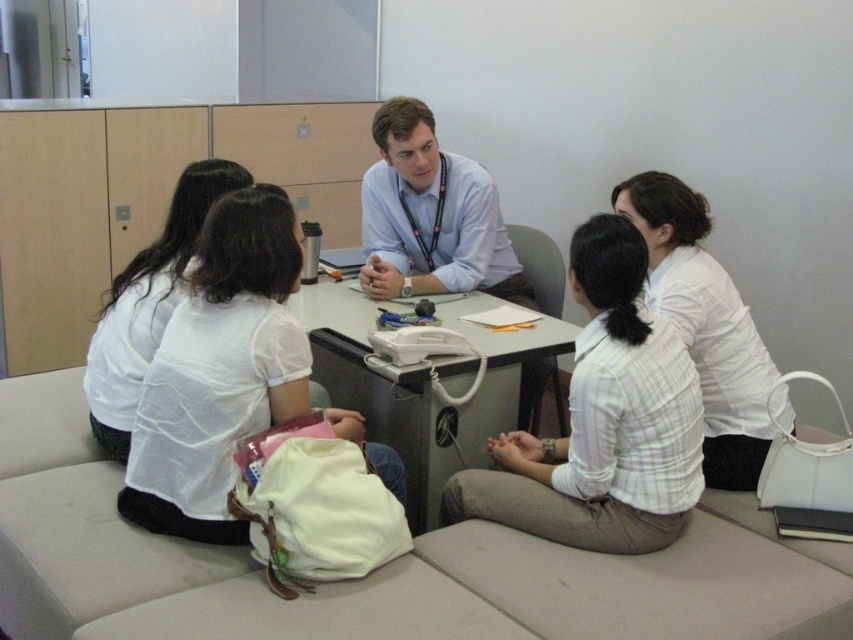
Does white matte backpack at lower left have a smaller size compared to white fabric shirt at left?

Incorrect, white matte backpack at lower left is not smaller in size than white fabric shirt at left.

Measure the distance between white matte backpack at lower left and camera.

A distance of 5.88 feet exists between white matte backpack at lower left and camera.

Identify the location of white matte backpack at lower left. This screenshot has width=853, height=640. (219, 371).

Who is positioned more to the left, white plastic table at center or white textured shirt at right?

white plastic table at center is more to the left.

Which is behind, point (328, 305) or point (656, 188)?

Positioned behind is point (328, 305).

Where is `white plastic table at center`? Image resolution: width=853 pixels, height=640 pixels. white plastic table at center is located at coordinates (427, 387).

Between white textured shirt at right and white fabric shirt at left, which one appears on the left side from the viewer's perspective?

white fabric shirt at left

Between point (720, 454) and point (144, 340), which one is positioned behind?

Positioned behind is point (720, 454).

Is point (755, 355) positioned before point (138, 275)?

Yes, point (755, 355) is in front of point (138, 275).

The width and height of the screenshot is (853, 640). I want to click on white textured shirt at right, so click(708, 328).